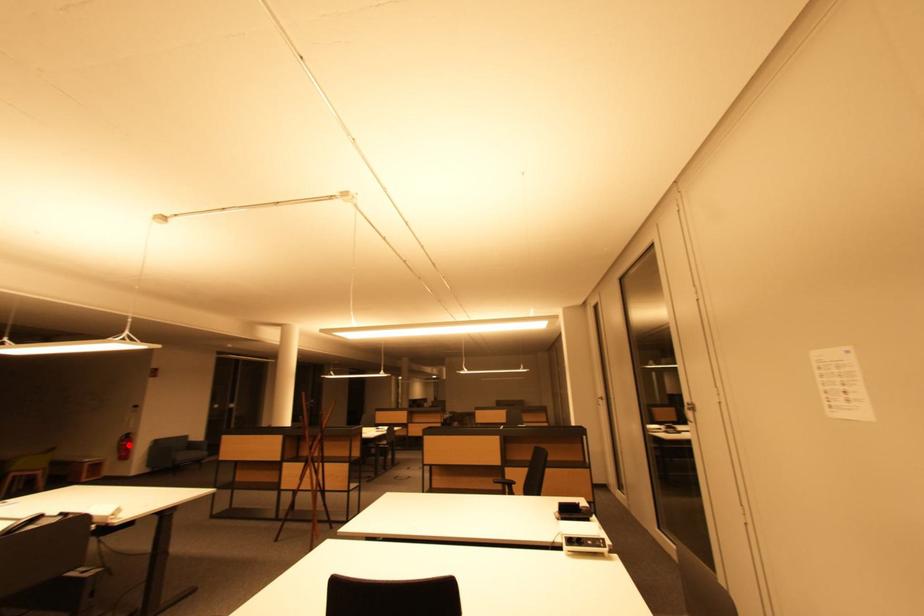
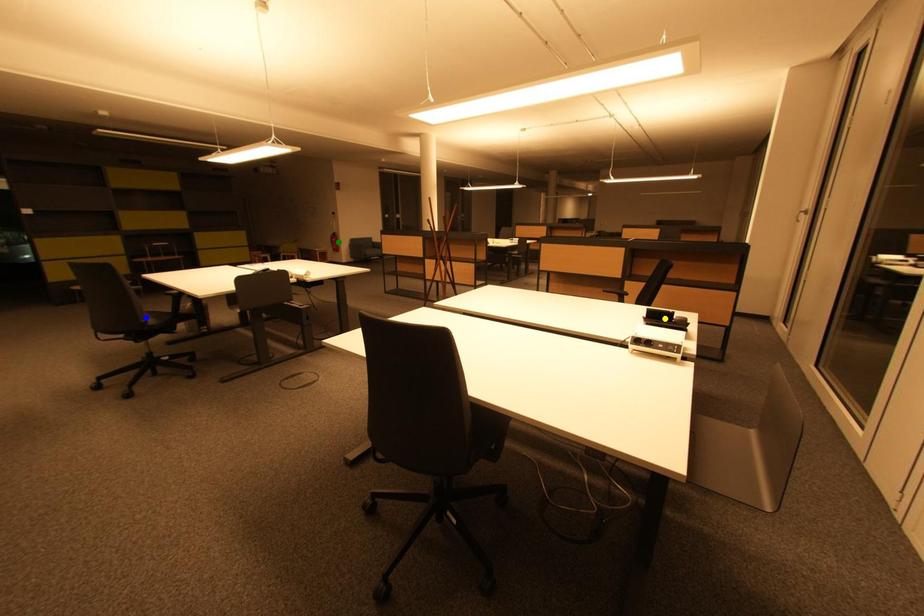
Question: I am providing you with two images of the same scene from different viewpoints. A red point is marked on the first image. You are given multiple points on the second image. Which point in image 2 is actually the same real-world point as the red point in image 1?

Choices:
 (A) yellow point
 (B) green point
 (C) blue point

Answer: (B)